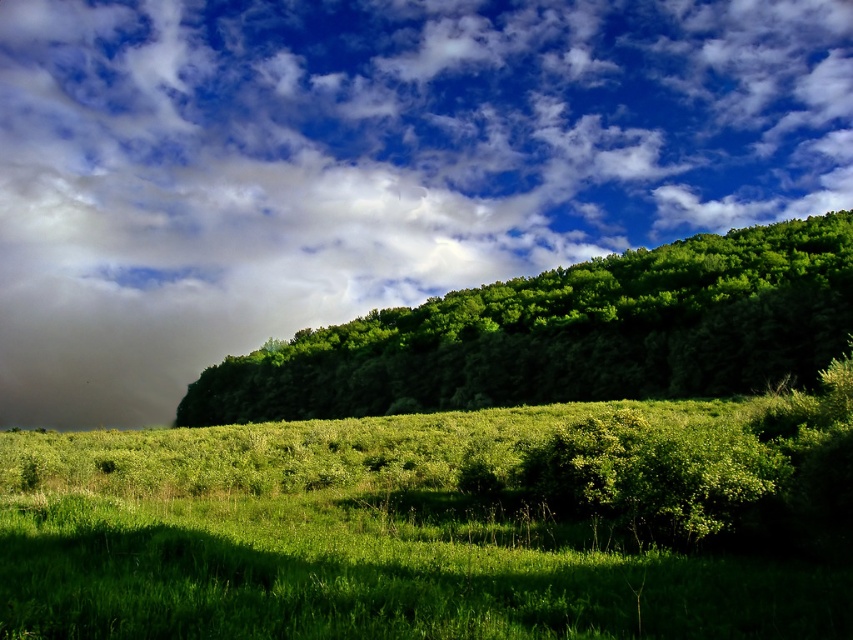
You are standing in the field of grass and looking towards the dark gray cloud at upper left and the green leafy tree at upper center. Which object appears taller in the sky?

The dark gray cloud at upper left appears taller in the sky than the green leafy tree at upper center because it has a greater height according to the description.

In the scene shown: You are an airplane pilot approaching the airport and notice two objects in the sky. You see the dark gray cloud at upper left and the green leafy tree at upper center. Which object is wider?

The dark gray cloud at upper left is wider than the green leafy tree at upper center because its width surpasses that of the tree.

From the picture: You are an airplane pilot preparing for takeoff. You notice two objects in the sky ahead of you. The first is the dark gray cloud at upper left, and the second is the green leafy tree at upper center. Which of these two objects poses a greater potential hazard to your flight path?

The dark gray cloud at upper left is larger in size than the green leafy tree at upper center, making it the greater potential hazard to the flight path.